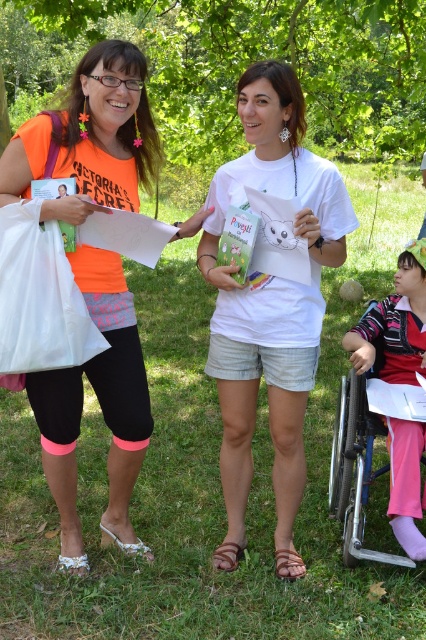
Question: Which of these objects is positioned farthest from the white fabric bag at left?

Choices:
 (A) neon orange fabric at left
 (B) pink fabric pants at lower right
 (C) white matte t-shirt at center

Answer: (B)

Question: Which is farther from the white fabric bag at left?

Choices:
 (A) neon orange fabric at left
 (B) white matte t-shirt at center

Answer: (B)

Question: Does neon orange fabric at left have a lesser width compared to pink fabric pants at lower right?

Choices:
 (A) no
 (B) yes

Answer: (A)

Question: Can you confirm if white matte t-shirt at center is positioned to the left of white fabric bag at left?

Choices:
 (A) no
 (B) yes

Answer: (A)

Question: Which point is farther from the camera taking this photo?

Choices:
 (A) (405, 492)
 (B) (66, 458)
 (C) (5, 269)
 (D) (305, 195)

Answer: (A)

Question: Does neon orange fabric at left appear under white fabric bag at left?

Choices:
 (A) no
 (B) yes

Answer: (B)